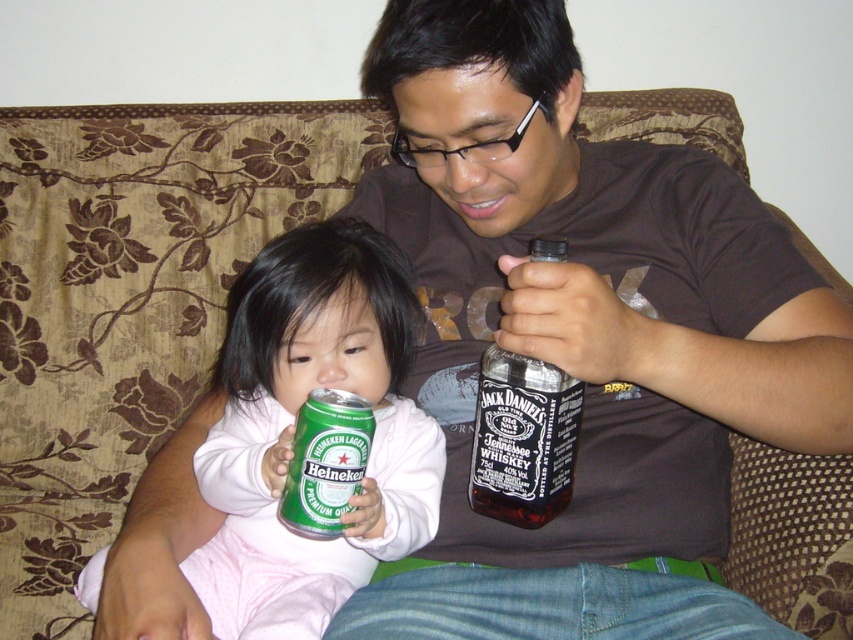
Does point (285, 536) lie in front of point (485, 467)?

No, it is behind (485, 467).

In the scene shown: Can you confirm if green matte heineken can at left is positioned to the right of clear glass bottle of jack daniel's tennessee whiskey at center?

In fact, green matte heineken can at left is to the left of clear glass bottle of jack daniel's tennessee whiskey at center.

Where is `green matte heineken can at left`? The image size is (853, 640). green matte heineken can at left is located at coordinates (293, 428).

Between clear glass bottle of jack daniel's tennessee whiskey at center and green metallic can at center, which one appears on the left side from the viewer's perspective?

From the viewer's perspective, green metallic can at center appears more on the left side.

Is clear glass bottle of jack daniel's tennessee whiskey at center to the right of green metallic can at center from the viewer's perspective?

Correct, you'll find clear glass bottle of jack daniel's tennessee whiskey at center to the right of green metallic can at center.

What do you see at coordinates (523, 438) in the screenshot?
I see `clear glass bottle of jack daniel's tennessee whiskey at center` at bounding box center [523, 438].

Where is `clear glass bottle of jack daniel's tennessee whiskey at center`? Image resolution: width=853 pixels, height=640 pixels. clear glass bottle of jack daniel's tennessee whiskey at center is located at coordinates (523, 438).

Is point (230, 410) positioned behind point (318, 390)?

Yes, point (230, 410) is farther from viewer.

This screenshot has width=853, height=640. Describe the element at coordinates (293, 428) in the screenshot. I see `green matte heineken can at left` at that location.

Find the location of a particular element. This screenshot has height=640, width=853. green matte heineken can at left is located at coordinates (293, 428).